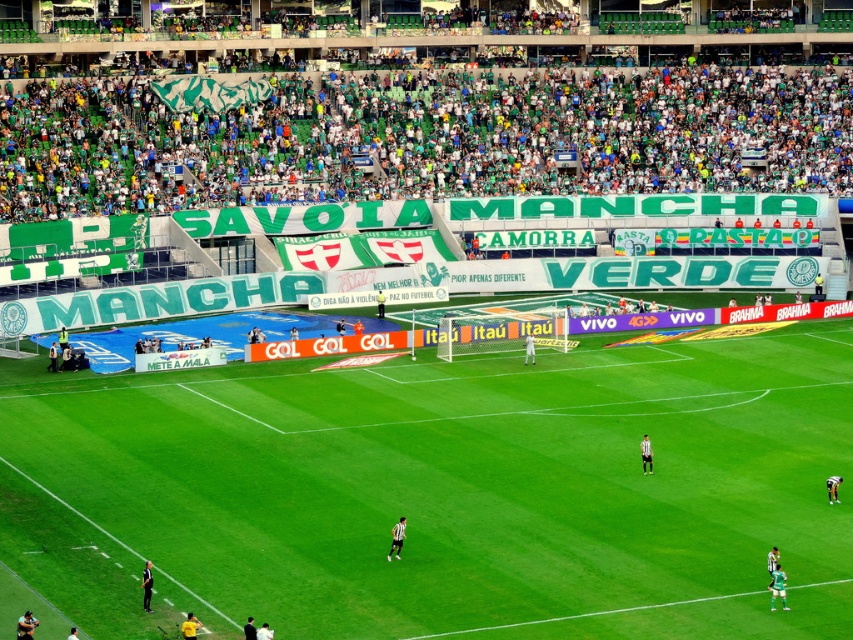
Is green matte jersey at lower right wider than green jersey at center?

Yes, green matte jersey at lower right is wider than green jersey at center.

Is point (775, 573) behind point (378, 317)?

That is False.

Locate an element on the screen. Image resolution: width=853 pixels, height=640 pixels. green matte jersey at lower right is located at coordinates (776, 588).

Which is more to the left, black leather jacket at lower left or white shirt at center?

From the viewer's perspective, black leather jacket at lower left appears more on the left side.

Who is lower down, black leather jacket at lower left or white shirt at center?

Positioned lower is black leather jacket at lower left.

What do you see at coordinates (26, 625) in the screenshot? I see `black leather jacket at lower left` at bounding box center [26, 625].

This screenshot has width=853, height=640. Identify the location of black leather jacket at lower left. (26, 625).

Image resolution: width=853 pixels, height=640 pixels. In order to click on white jersey at center in this screenshot , I will do `click(529, 349)`.

Does white jersey at center have a lesser height compared to dark green jersey at center?

In fact, white jersey at center may be taller than dark green jersey at center.

Who is more distant from viewer, [532,352] or [248,632]?

Positioned behind is point [532,352].

Locate an element on the screen. This screenshot has height=640, width=853. white jersey at center is located at coordinates (529, 349).